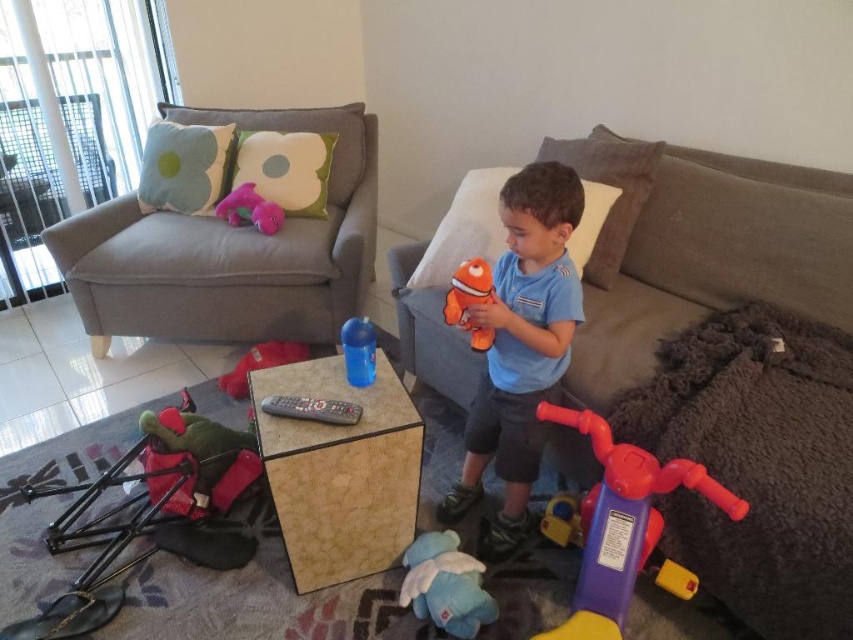
You are a parent trying to store the rubberized purple and red tricycle at lower right and the black plastic remote at center in a drawer. The drawer is 30 cm wide. Can both items fit side by side?

The rubberized purple and red tricycle at lower right is wider than the black plastic remote at center. Since the tricycle alone may already exceed the drawer width of 30 cm, placing both side by side would likely not fit.

You are a parent looking for your child. You see the blue cotton shirt at center and the pink plush toy at upper left. Which object is bigger?

The blue cotton shirt at center is larger in size than the pink plush toy at upper left.